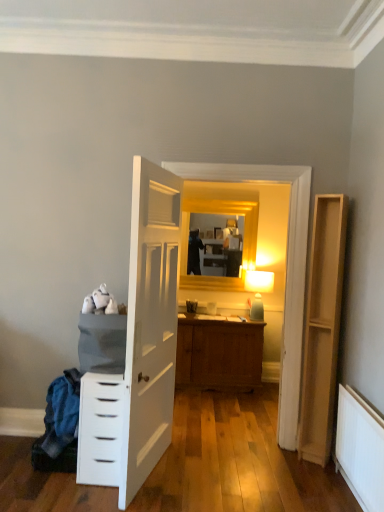
The width and height of the screenshot is (384, 512). I want to click on vacant region under light brown wood file cabinet at right (from a real-world perspective), so click(312, 462).